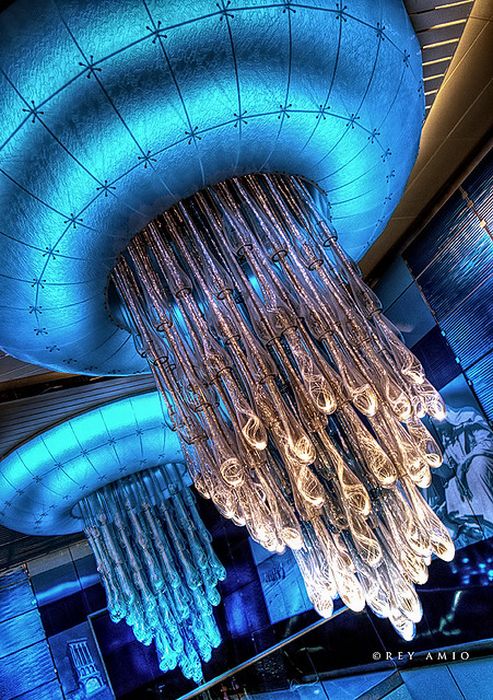
This screenshot has width=493, height=700. What are the coordinates of `yellow lights` in the screenshot? It's located at (468, 38).